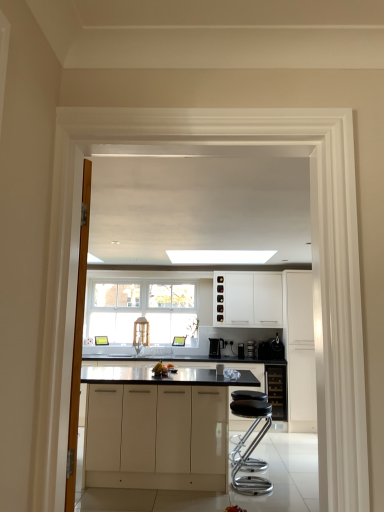
Question: Is white matte cabinet at center, the 1th cabinetry viewed from the back, to the right of white matte cabinet at right, the second cabinetry in the front-to-back sequence, from the viewer's perspective?

Choices:
 (A) no
 (B) yes

Answer: (A)

Question: Can you confirm if white matte cabinet at center, the fourth cabinetry positioned from the front, is shorter than white matte cabinet at right, which is the 1th cabinetry in right-to-left order?

Choices:
 (A) no
 (B) yes

Answer: (B)

Question: Is white matte cabinet at center, the 1th cabinetry viewed from the back, in front of white matte cabinet at right, which is the 1th cabinetry in right-to-left order?

Choices:
 (A) yes
 (B) no

Answer: (B)

Question: Is white matte cabinet at center, the 1th cabinetry viewed from the back, outside of white matte cabinet at right, positioned as the third cabinetry in back-to-front order?

Choices:
 (A) yes
 (B) no

Answer: (A)

Question: From a real-world perspective, is white matte cabinet at center, marked as the 2th cabinetry in a left-to-right arrangement, over white matte cabinet at right, which is the 1th cabinetry in right-to-left order?

Choices:
 (A) yes
 (B) no

Answer: (A)

Question: In terms of height, does satin black coffee machine at center look taller or shorter compared to satin silver toaster at center, arranged as the 1th appliance when viewed from the left?

Choices:
 (A) short
 (B) tall

Answer: (B)

Question: From a real-world perspective, relative to satin silver toaster at center, arranged as the 1th appliance when viewed from the left, is satin black coffee machine at center vertically above or below?

Choices:
 (A) below
 (B) above

Answer: (B)

Question: In the image, is satin black coffee machine at center on the left side or the right side of satin silver toaster at center, arranged as the 1th appliance when viewed from the left?

Choices:
 (A) right
 (B) left

Answer: (B)

Question: From the image's perspective, is satin black coffee machine at center positioned above or below satin silver toaster at center, arranged as the 1th appliance when viewed from the left?

Choices:
 (A) below
 (B) above

Answer: (B)

Question: Is white matte cabinetry at center, the 1th cabinetry positioned from the left, bigger or smaller than metallic silver coffee machine at center, the second appliance in the right-to-left sequence?

Choices:
 (A) big
 (B) small

Answer: (A)

Question: Considering the positions of point (208, 455) and point (264, 351), is point (208, 455) closer or farther from the camera than point (264, 351)?

Choices:
 (A) farther
 (B) closer

Answer: (B)

Question: Is white matte cabinetry at center, the fourth cabinetry from the right, wider or thinner than metallic silver coffee machine at center, which ranks as the 2th appliance in left-to-right order?

Choices:
 (A) thin
 (B) wide

Answer: (B)

Question: Relative to metallic silver coffee machine at center, the second appliance in the right-to-left sequence, is white matte cabinetry at center, the 1th cabinetry positioned from the left, in front or behind?

Choices:
 (A) front
 (B) behind

Answer: (A)

Question: In terms of width, does white matte cabinetry at center, the 1th cabinetry positioned from the left, look wider or thinner when compared to white matte cabinet at center, arranged as the third cabinetry when viewed from the right?

Choices:
 (A) wide
 (B) thin

Answer: (A)

Question: From a real-world perspective, is white matte cabinetry at center, the fourth cabinetry from the right, positioned above or below white matte cabinet at center, the 1th cabinetry viewed from the back?

Choices:
 (A) above
 (B) below

Answer: (B)